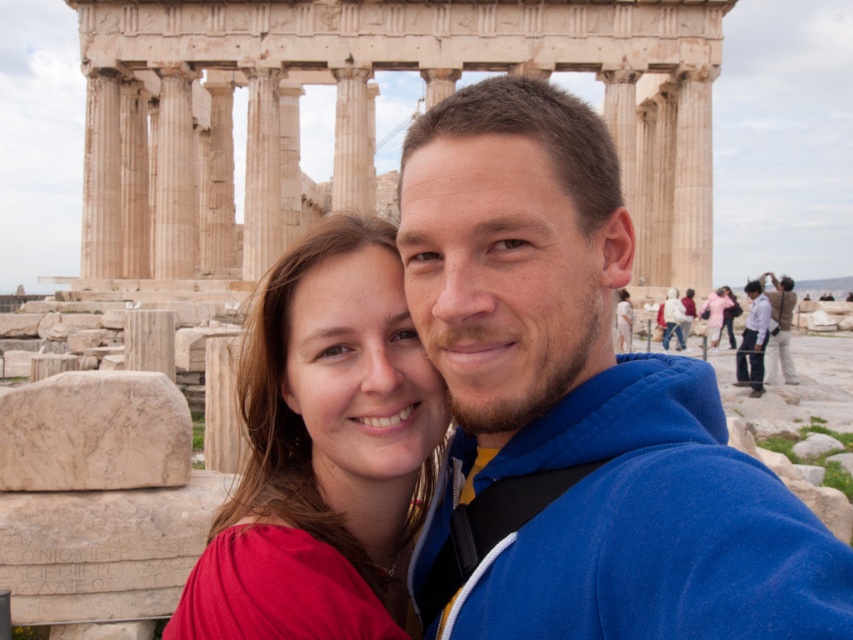
Question: Which of the following is the farthest from the observer?

Choices:
 (A) (784, 314)
 (B) (766, 326)

Answer: (A)

Question: Is matte red dress at center bigger than light blue shirt at center?

Choices:
 (A) no
 (B) yes

Answer: (B)

Question: Based on their relative distances, which object is farther from the matte red dress at center?

Choices:
 (A) blue fleece jacket at center
 (B) light brown leather jacket at right

Answer: (B)

Question: Which of the following is the closest to the observer?

Choices:
 (A) (757, 531)
 (B) (213, 545)
 (C) (750, 323)
 (D) (790, 356)

Answer: (A)

Question: Considering the relative positions of blue fleece jacket at center and matte red dress at center in the image provided, where is blue fleece jacket at center located with respect to matte red dress at center?

Choices:
 (A) left
 (B) right

Answer: (B)

Question: Is blue fleece jacket at center above light brown leather jacket at right?

Choices:
 (A) yes
 (B) no

Answer: (B)